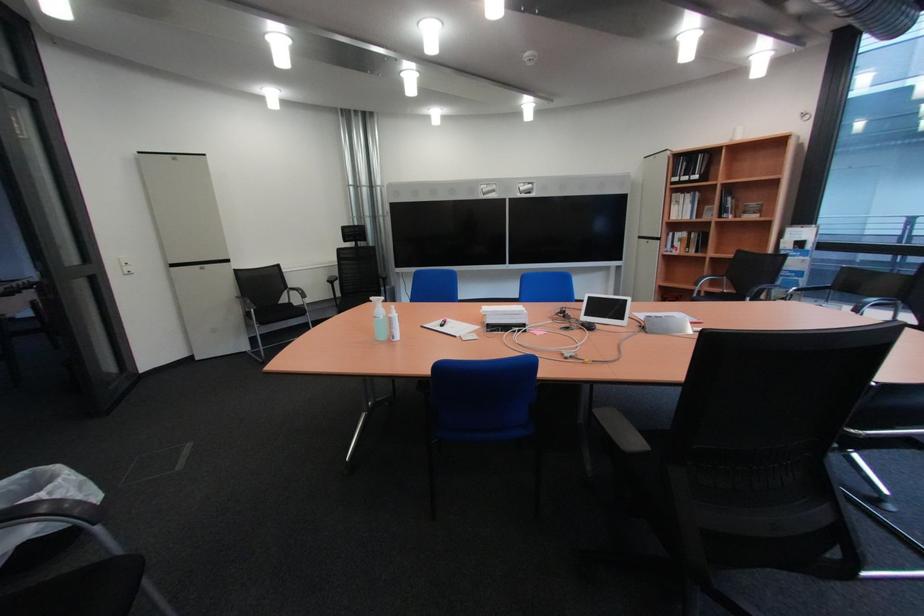
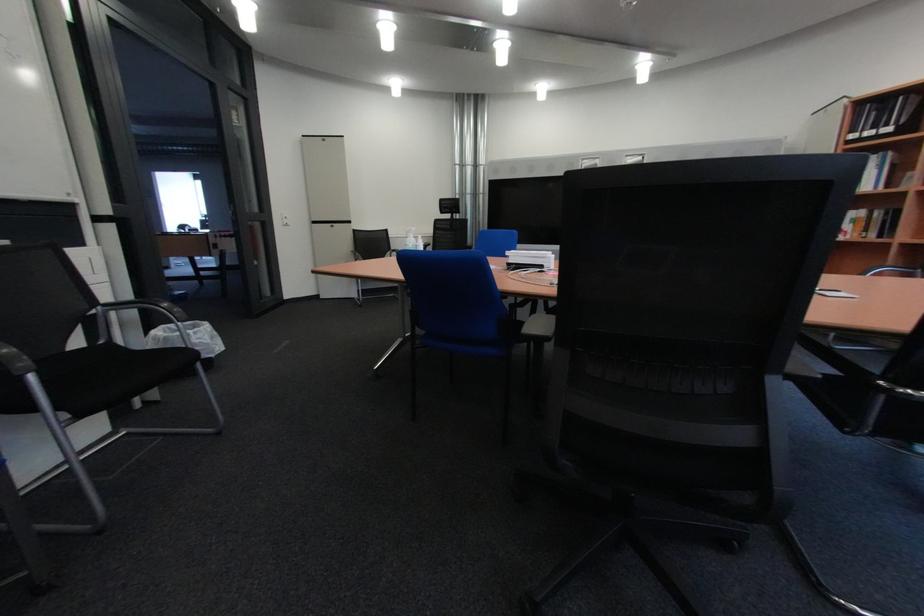
Question: How did the camera likely rotate?

Choices:
 (A) Left
 (B) Right
 (C) Up
 (D) Down

Answer: (A)